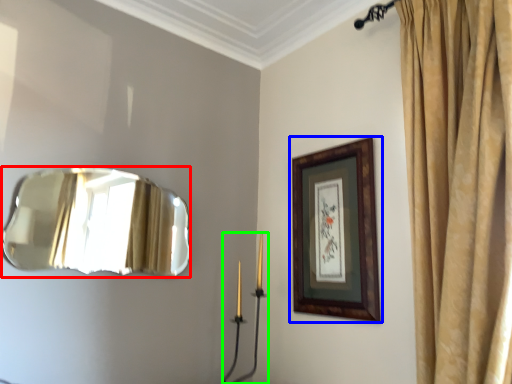
Question: Which is nearer to the mirror (highlighted by a red box)? picture frame (highlighted by a blue box) or candle holder (highlighted by a green box).

Choices:
 (A) picture frame
 (B) candle holder

Answer: (B)